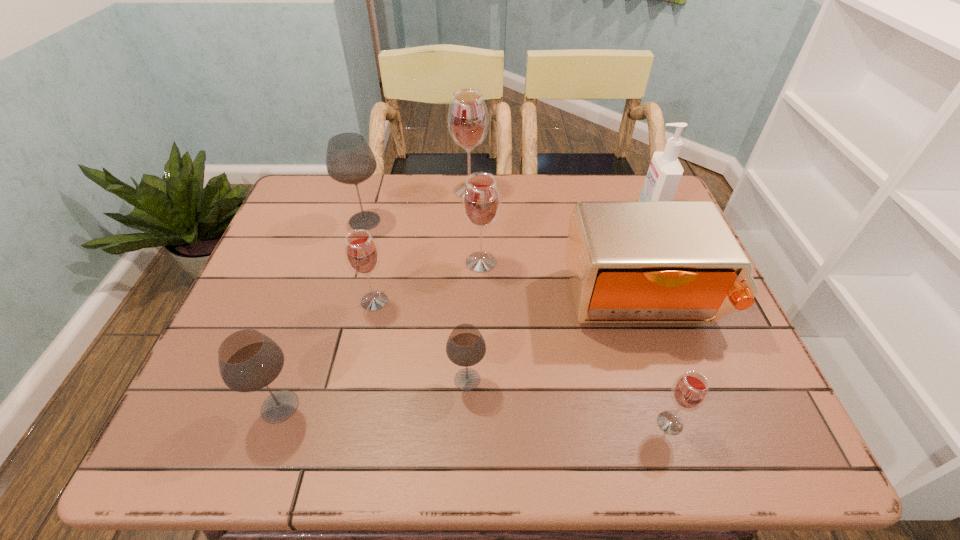
At what (x,y) coordinates should I click in order to perform the action: click on the second smallest gray wineglass. Please return your answer as a coordinate pair (x, y). The image size is (960, 540). Looking at the image, I should click on (248, 360).

Find the location of a particular element. The height and width of the screenshot is (540, 960). the smallest gray wineglass is located at coordinates (465, 347).

Image resolution: width=960 pixels, height=540 pixels. I want to click on the rightmost wineglass, so click(x=690, y=391).

You are a GUI agent. You are given a task and a screenshot of the screen. Output one action in this format:
    pyautogui.click(x=<x>, y=<y>)
    Task: Click on the nearest red wineglass
    This screenshot has width=960, height=540.
    Given the screenshot: What is the action you would take?
    click(690, 391)

Locate an element on the screen. The image size is (960, 540). free space located 0.060m on the left of the farthest wineglass is located at coordinates (432, 191).

Locate an element on the screen. This screenshot has width=960, height=540. free spot located 0.380m on the front label of the cleansing agent is located at coordinates (511, 211).

Find the location of a particular element. vacant space located 0.070m on the front label of the cleansing agent is located at coordinates (615, 211).

Image resolution: width=960 pixels, height=540 pixels. In order to click on free spot located 0.090m on the front label of the cleansing agent in this screenshot , I will do `click(609, 211)`.

This screenshot has height=540, width=960. I want to click on blank area located 0.150m on the front of the second farthest wineglass, so click(x=349, y=274).

Where is `vacant space located on the right of the third smallest red wineglass`? This screenshot has height=540, width=960. vacant space located on the right of the third smallest red wineglass is located at coordinates (534, 262).